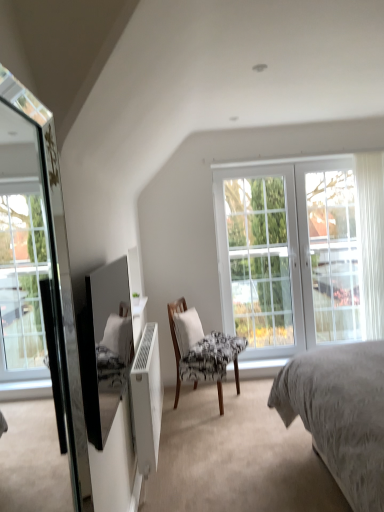
At what (x,y) coordinates should I click in order to perform the action: click on empty space that is ontop of white sheer curtain at right (from a real-world perspective). Please return your answer as a coordinate pair (x, y). Looking at the image, I should click on (360, 146).